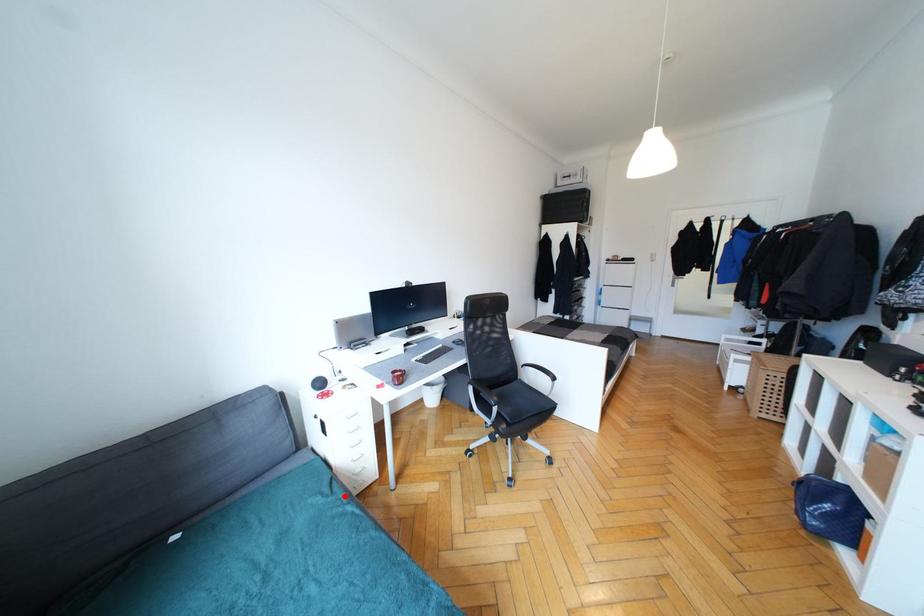
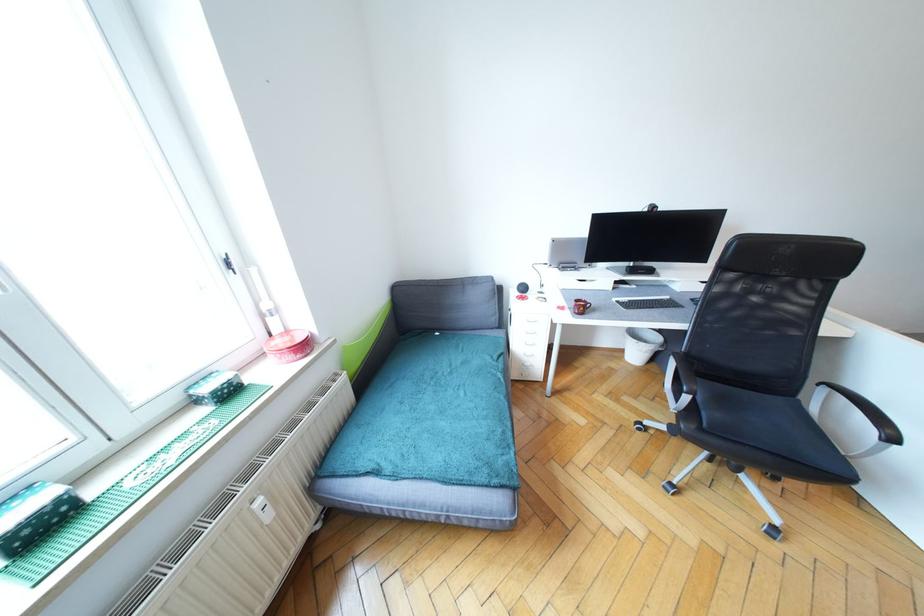
Locate, in the second image, the point that corresponds to the highlighted location in the first image.

(504, 367)